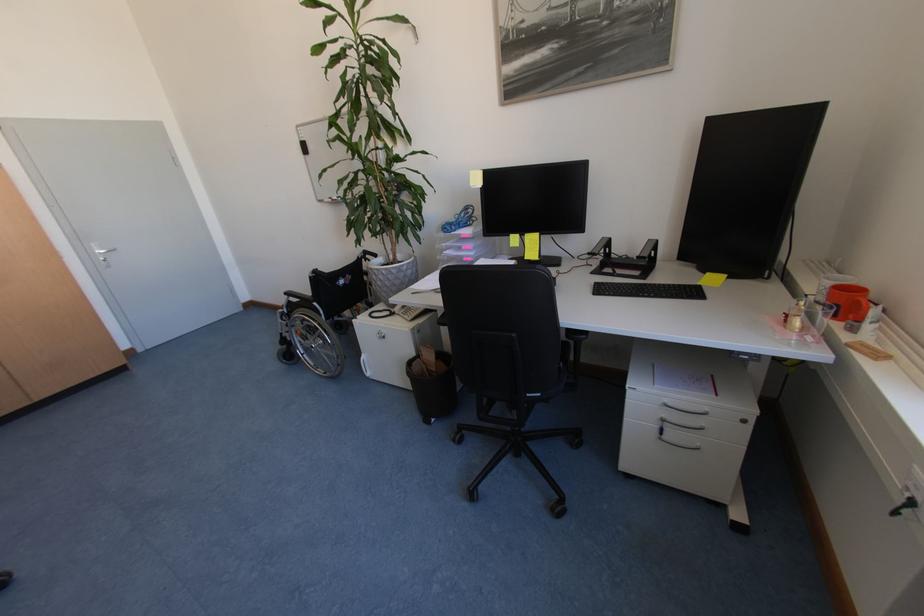
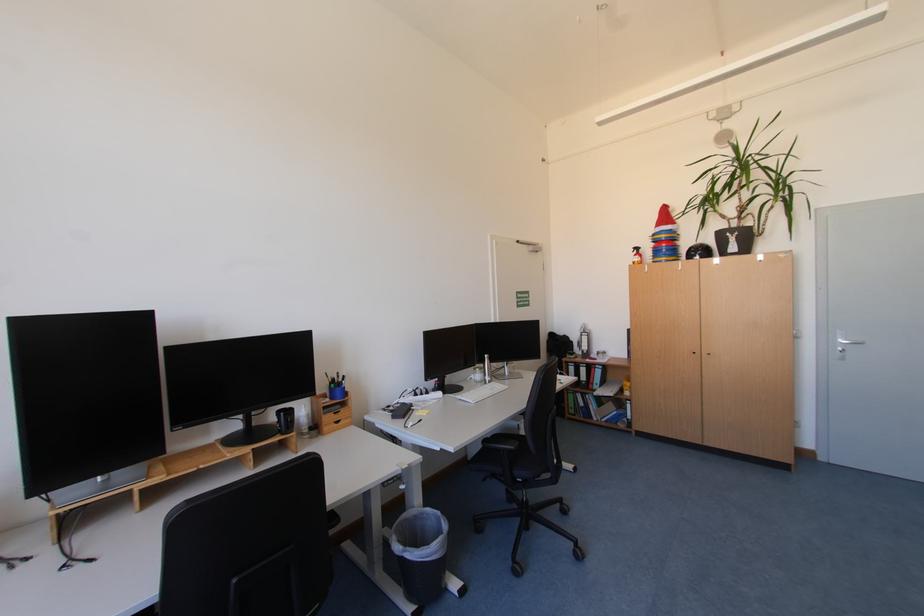
In the second image, find the point that corresponds to the point at 105,253 in the first image.

(848, 341)